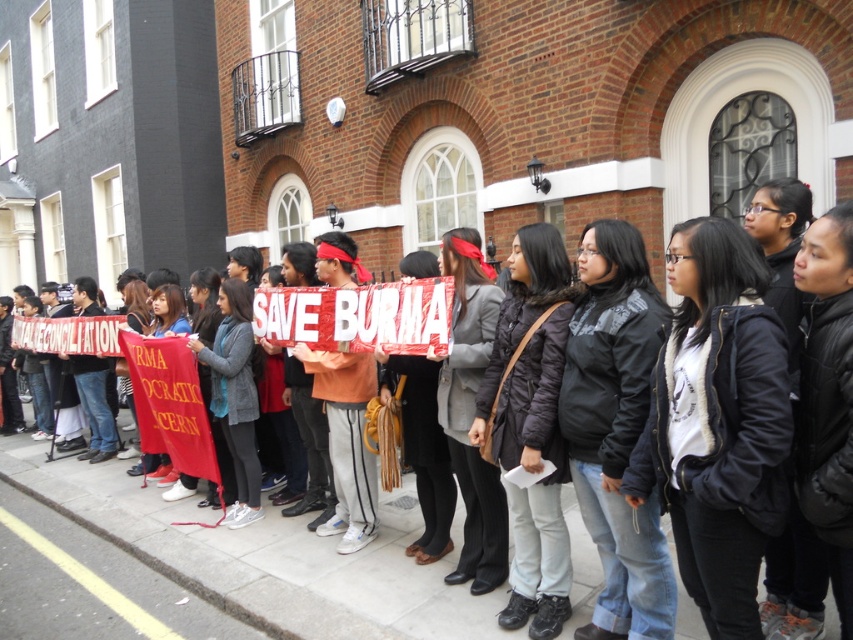
Consider the image. You are a pedestrian walking on the sidewalk and see the red fabric banner at center and the yellow painted line at lower center. Which object is closer to you?

The red fabric banner at center is closer to you because it is positioned over the yellow painted line at lower center, indicating it is in front of it.

You are a photographer trying to capture the protest scene. You notice a point at coordinates (x=268, y=557). What object is located at this point?

The point at coordinates (x=268, y=557) corresponds to the red fabric banner at center.

You are a photographer standing at the corner of the street, aiming to capture the red fabric banner at center in your shot. Given that your camera has a focal length of 50mm and you are 10 meters away from the building, can you estimate whether the banner will be in the center of the photo based on its coordinates?

The red fabric banner at center is positioned at coordinates point [268,557], which would place it slightly off the exact center of the photo. However, depending on the camera sensor size and aspect ratio, it might still appear near the center in the frame.